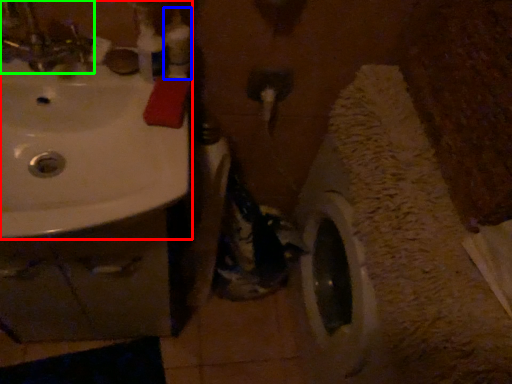
Question: Which object is the closest to the sink (highlighted by a red box)? Choose among these: toiletry (highlighted by a blue box) or tap (highlighted by a green box).

Choices:
 (A) toiletry
 (B) tap

Answer: (B)